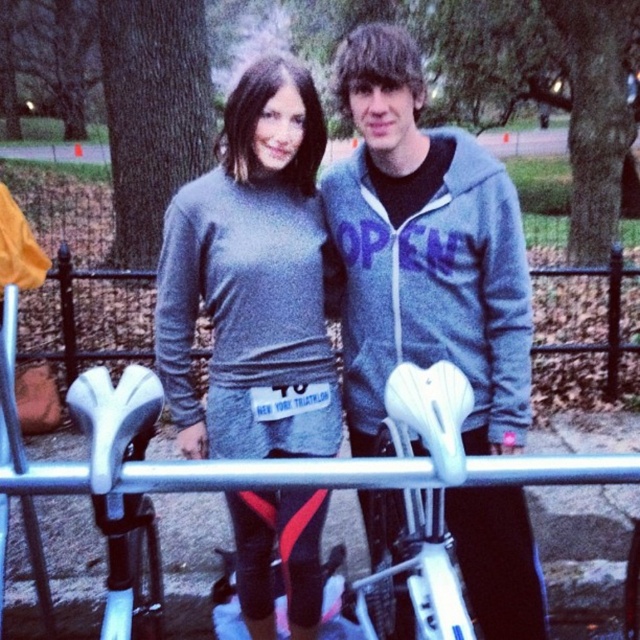
Can you confirm if gray matte sweater at center is wider than white matte bicycle seat at center?

Incorrect, gray matte sweater at center's width does not surpass white matte bicycle seat at center's.

Does gray matte sweater at center have a larger size compared to white matte bicycle seat at center?

Yes, gray matte sweater at center is bigger than white matte bicycle seat at center.

Is point (227, 106) positioned before point (490, 476)?

No, (227, 106) is further to viewer.

Where is `gray matte sweater at center`? The width and height of the screenshot is (640, 640). gray matte sweater at center is located at coordinates (252, 280).

Is gray fleece jacket at center to the right of white matte bicycle seat at center from the viewer's perspective?

Correct, you'll find gray fleece jacket at center to the right of white matte bicycle seat at center.

Does gray fleece jacket at center have a larger size compared to white matte bicycle seat at center?

Yes.

Between point (387, 316) and point (225, 488), which one is positioned behind?

Positioned behind is point (387, 316).

Find the location of a particular element. This screenshot has height=640, width=640. gray fleece jacket at center is located at coordinates (422, 250).

Does gray fleece jacket at center have a greater width compared to gray matte sweater at center?

Yes, gray fleece jacket at center is wider than gray matte sweater at center.

Who is more forward, (436, 221) or (308, 195)?

Point (436, 221) is in front.

Is point (480, 493) positioned after point (266, 246)?

Yes, it is.

Identify the location of gray fleece jacket at center. (422, 250).